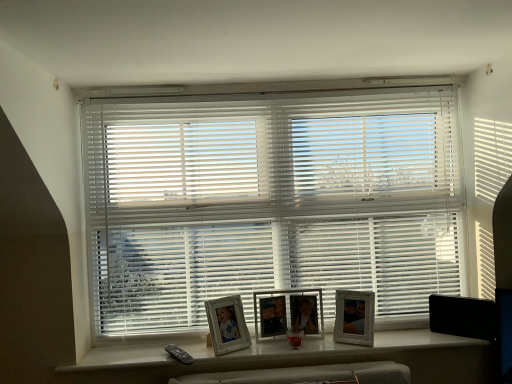
Question: In terms of width, does white plastic blinds at center look wider or thinner when compared to wooden photo frame at center, placed as the second picture frame when sorted from right to left?

Choices:
 (A) wide
 (B) thin

Answer: (A)

Question: From the image's perspective, is white plastic blinds at center above or below wooden photo frame at center, placed as the second picture frame when sorted from right to left?

Choices:
 (A) below
 (B) above

Answer: (B)

Question: Estimate the real-world distances between objects in this image. Which object is closer to the wooden photo frame at center, placed as the second picture frame when sorted from right to left?

Choices:
 (A) white wooden picture frame at center, which is the first picture frame in left-to-right order
 (B) white plastic blinds at center
 (C) white plastic frames at center
 (D) white glossy picture frame at center, arranged as the 1th picture frame when viewed from the right

Answer: (A)

Question: Based on their relative distances, which object is nearer to the white glossy picture frame at center, marked as the third picture frame in a left-to-right arrangement?

Choices:
 (A) white plastic blinds at center
 (B) white plastic frames at center
 (C) white wooden picture frame at center, which is the first picture frame in left-to-right order
 (D) wooden photo frame at center, arranged as the second picture frame when viewed from the left

Answer: (D)